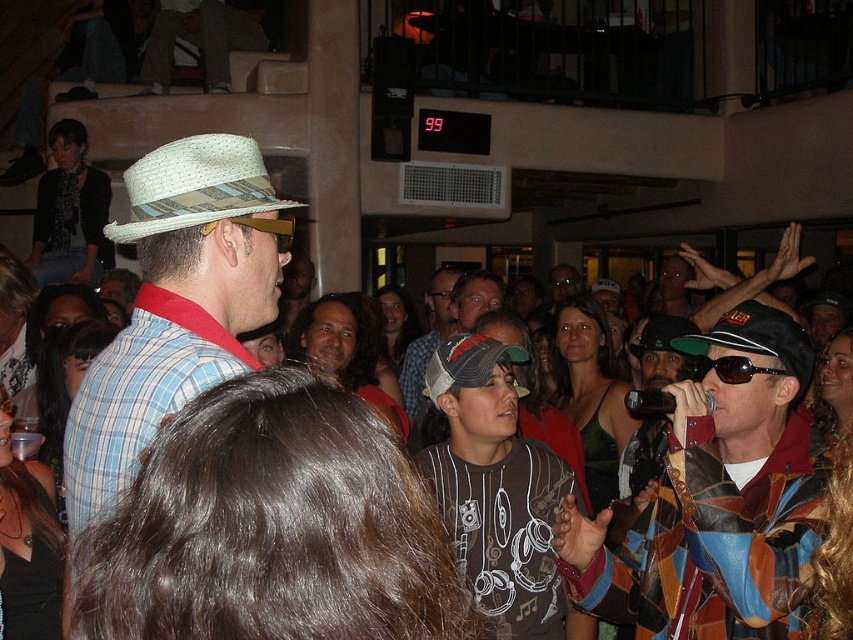
You are standing at the origin point of the coordinate system in the image. The microphone holder is at position 0.3, 0.2. Is the straw fedora at center closer to you than the microphone holder?

The straw fedora at center is at point [198,188], which is very close to the microphone holder at [170,192]. Since both coordinates are nearly the same, the distance from the origin would be almost identical. Therefore, the straw fedora at center is approximately the same distance from you as the microphone holder.

In the scene shown: You are a photographer standing at the back of the venue. You want to take a clear photo of the matte straw hat at upper left. The camera you are using has a maximum focus range of 30 feet. Can you capture the hat clearly?

The matte straw hat at upper left is 28.12 feet away from the camera, which is within the maximum focus range of 30 feet. Therefore, you can capture the hat clearly.